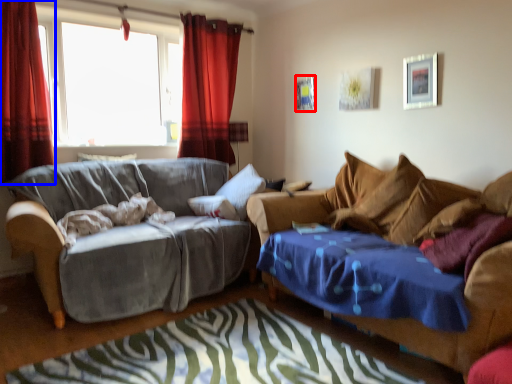
Question: Which point is closer to the camera, picture frame (highlighted by a red box) or curtain (highlighted by a blue box)?

Choices:
 (A) picture frame
 (B) curtain

Answer: (B)